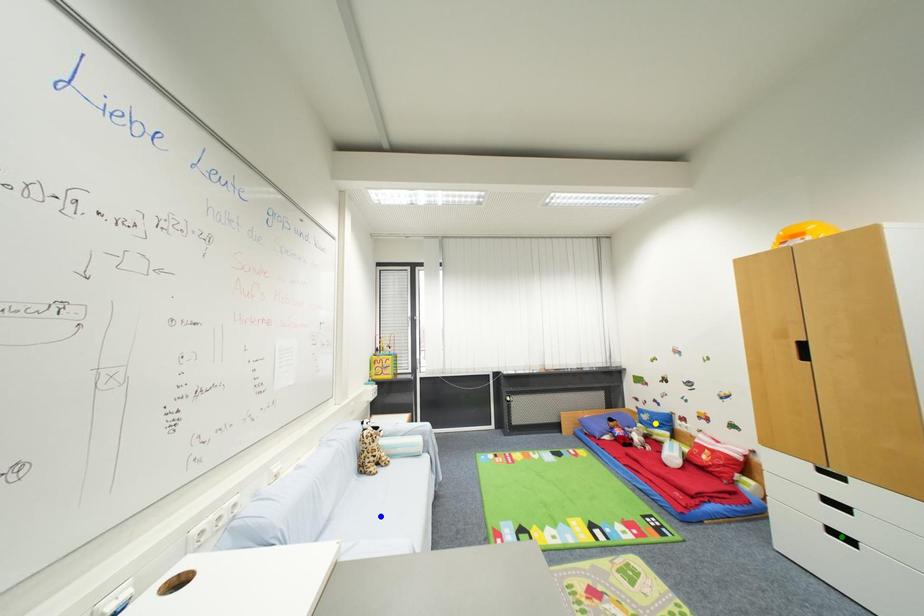
Order these from nearest to farthest:
green point, blue point, yellow point

green point → blue point → yellow point